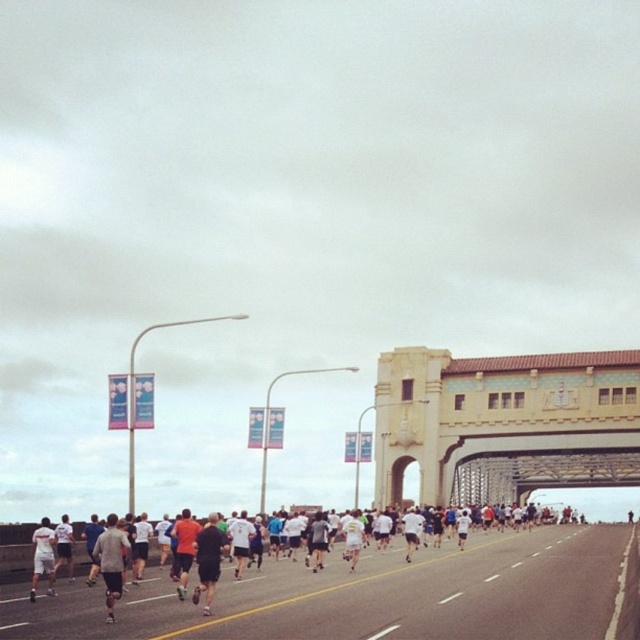
Question: Which of the following is the closest to the observer?

Choices:
 (A) (116, 518)
 (B) (56, 554)
 (C) (38, 524)
 (D) (444, 349)

Answer: (B)

Question: Can you confirm if black asphalt highway at center is smaller than white matte shorts at center?

Choices:
 (A) no
 (B) yes

Answer: (B)

Question: Which of these objects is positioned farthest from the white matte shorts at center?

Choices:
 (A) dark gray athletic wear at center
 (B) white matte shorts at lower left

Answer: (A)

Question: Is black asphalt highway at center smaller than yellow concrete bridge at center?

Choices:
 (A) yes
 (B) no

Answer: (B)

Question: Which of these objects is positioned closest to the white matte shorts at lower left?

Choices:
 (A) black asphalt highway at center
 (B) yellow concrete bridge at center

Answer: (A)

Question: Does black asphalt highway at center have a larger size compared to yellow concrete bridge at center?

Choices:
 (A) yes
 (B) no

Answer: (A)